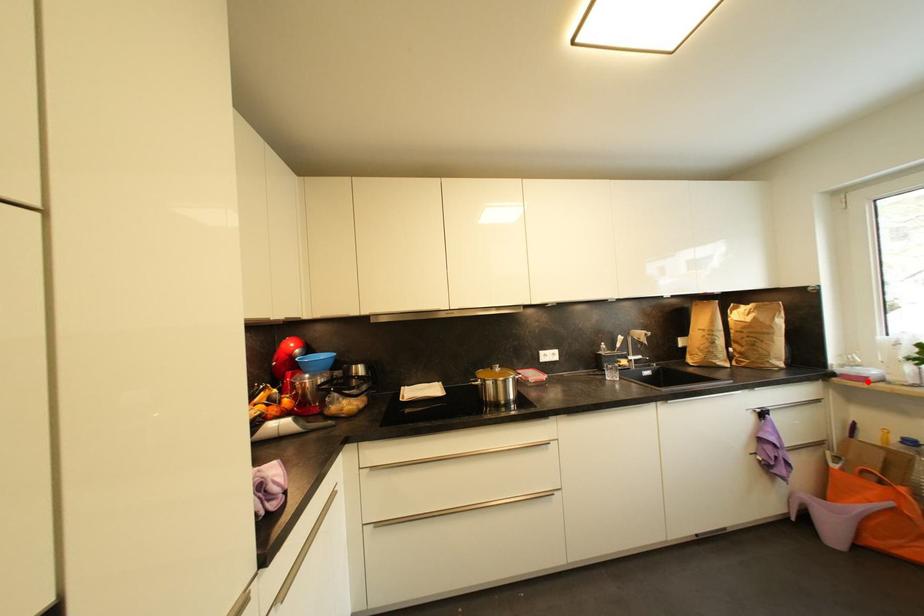
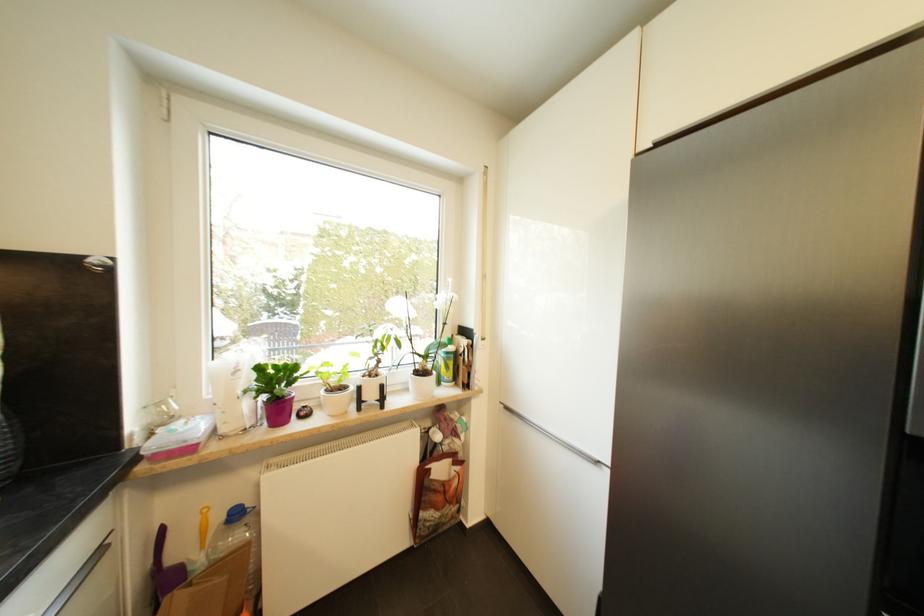
Question: I am providing you with two images of the same scene from different viewpoints. A red point is marked on the first image. Can you still see the location of the red point in image 2?

Choices:
 (A) Yes
 (B) No

Answer: (A)